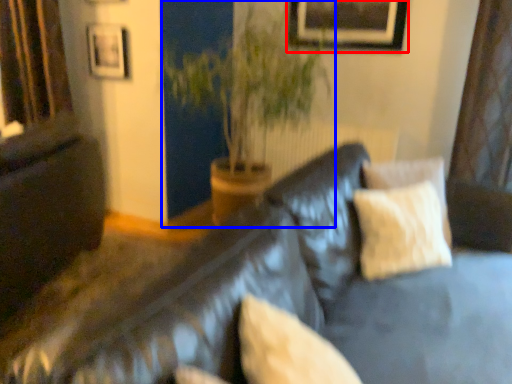
Question: Which object is closer to the camera taking this photo, picture frame (highlighted by a red box) or houseplant (highlighted by a blue box)?

Choices:
 (A) picture frame
 (B) houseplant

Answer: (B)